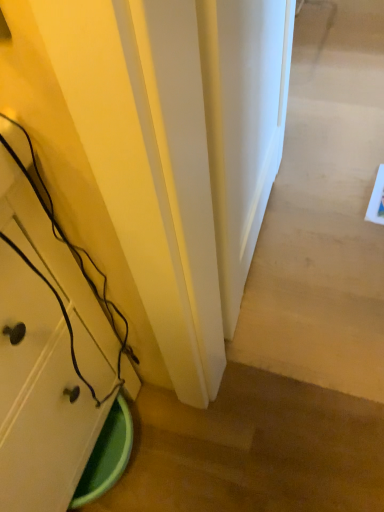
Find the location of `free spot below white smooth door at center (from a real-world perspective)`. free spot below white smooth door at center (from a real-world perspective) is located at coordinates (261, 237).